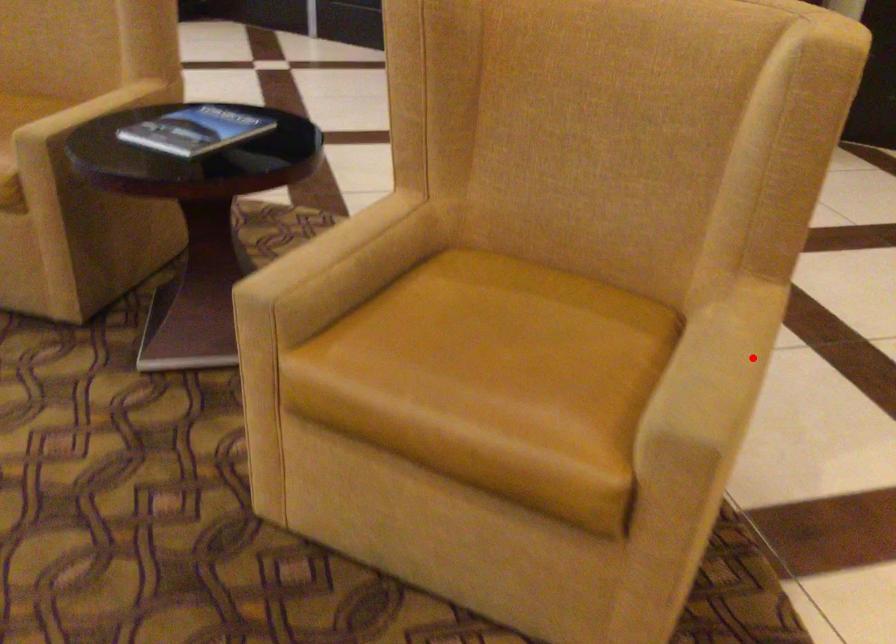
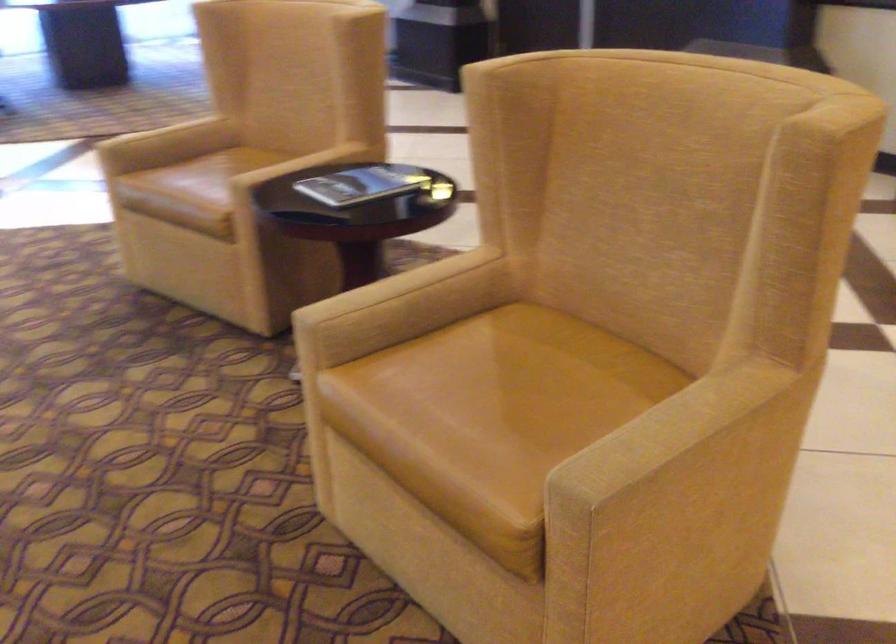
In the second image, find the point that corresponds to the highlighted location in the first image.

(707, 433)